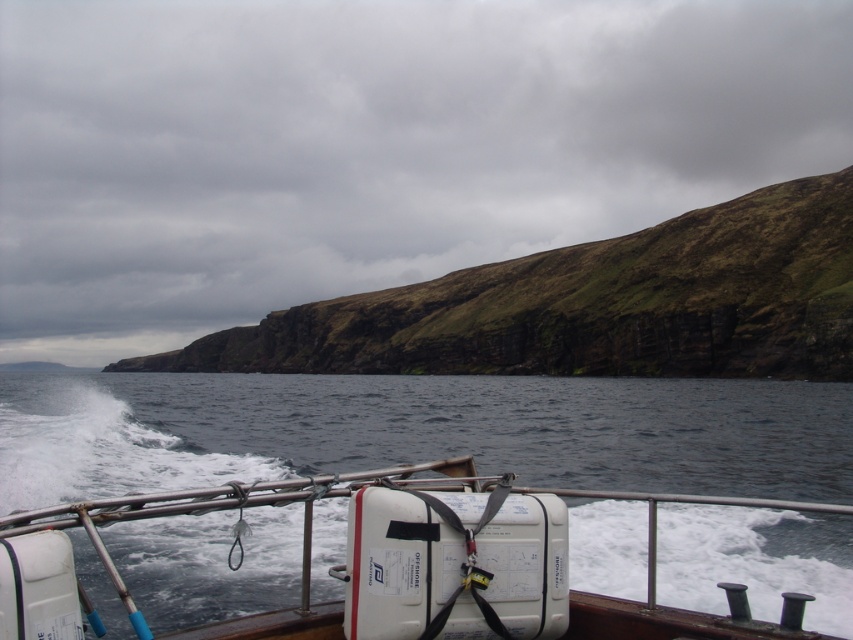
Is green grassy cliff at upper center bigger than white plastic container at center?

Correct, green grassy cliff at upper center is larger in size than white plastic container at center.

Is green grassy cliff at upper center in front of white plastic container at center?

No, green grassy cliff at upper center is further to the viewer.

What do you see at coordinates (593, 305) in the screenshot?
I see `green grassy cliff at upper center` at bounding box center [593, 305].

Identify the location of green grassy cliff at upper center. The height and width of the screenshot is (640, 853). (593, 305).